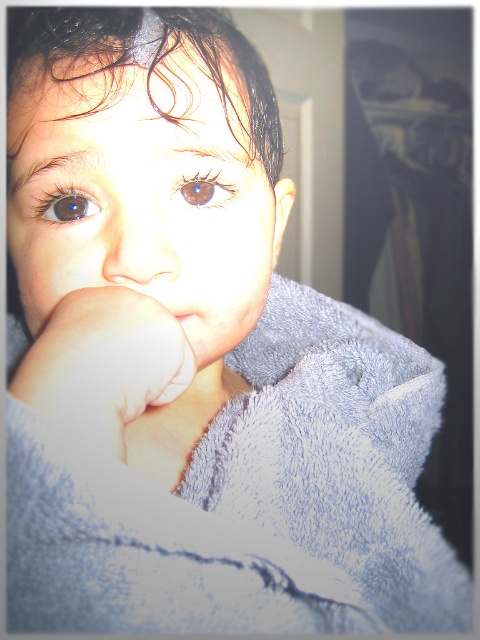
Is wet dark brown hair at upper left to the right of smooth flesh nose at center from the viewer's perspective?

Yes, wet dark brown hair at upper left is to the right of smooth flesh nose at center.

Between wet dark brown hair at upper left and smooth flesh nose at center, which one appears on the left side from the viewer's perspective?

smooth flesh nose at center

Does point (97, 42) come behind point (111, 268)?

No, (97, 42) is in front of (111, 268).

Locate an element on the screen. The height and width of the screenshot is (640, 480). wet dark brown hair at upper left is located at coordinates (149, 64).

Where is `brown matte eye at center`? The height and width of the screenshot is (640, 480). brown matte eye at center is located at coordinates (204, 188).

Which is above, brown matte eye at center or brown matte eye at upper left?

Positioned higher is brown matte eye at center.

Does point (193, 205) come in front of point (69, 209)?

Yes, it is.

The width and height of the screenshot is (480, 640). I want to click on brown matte eye at center, so click(204, 188).

Is matte gray towel at center above wet dark brown hair at upper left?

No.

Is matte gray towel at center in front of wet dark brown hair at upper left?

That is False.

Between point (21, 104) and point (44, 65), which one is positioned in front?

Positioned in front is point (44, 65).

Identify the location of matte gray towel at center. (144, 182).